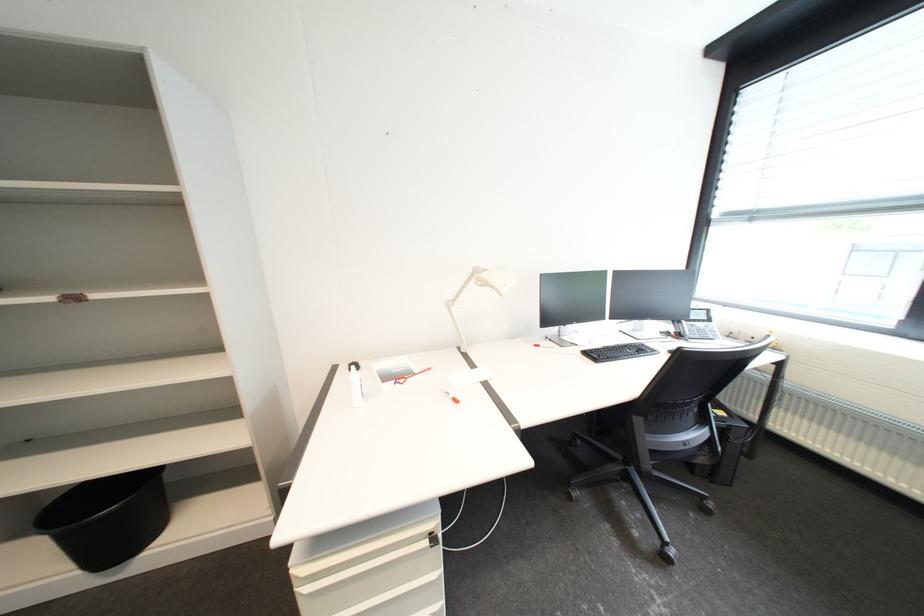
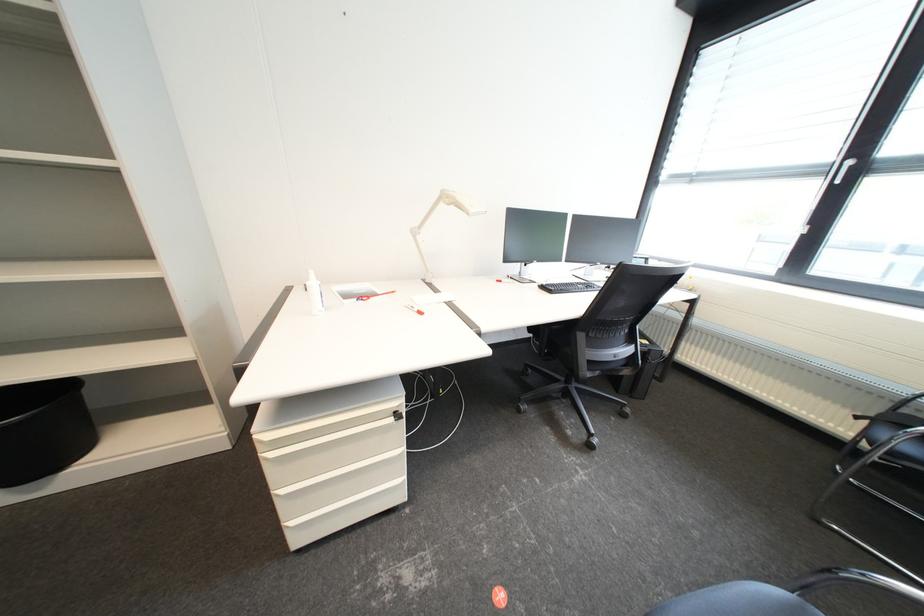
Question: The first image is from the beginning of the video and the second image is from the end. How did the camera likely rotate when shooting the video?

Choices:
 (A) Left
 (B) Right
 (C) Up
 (D) Down

Answer: (B)